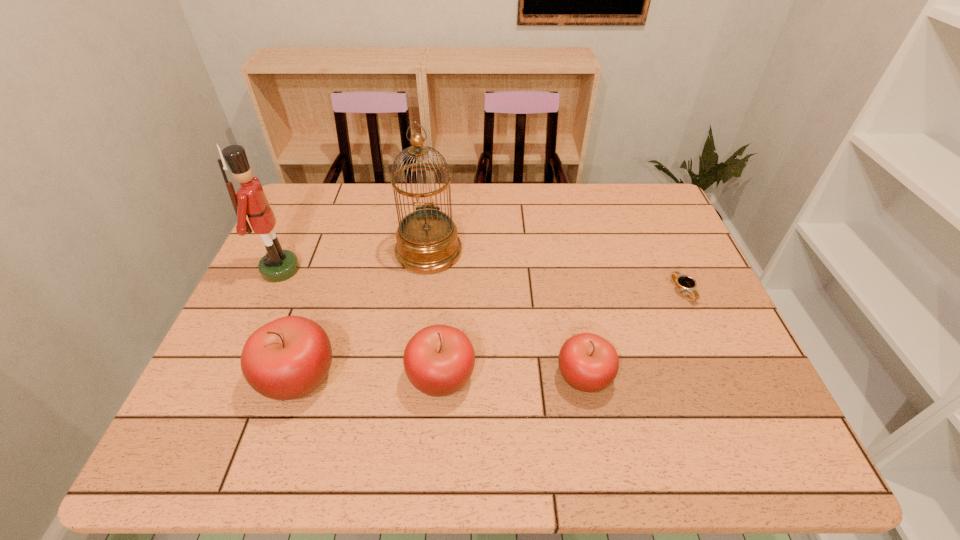
At what (x,y) coordinates should I click in order to perform the action: click on vacant space at the near edge of the desktop. Please return your answer as a coordinate pair (x, y). Looking at the image, I should click on point(384,411).

This screenshot has width=960, height=540. In order to click on vacant space at the left edge in this screenshot , I will do `click(296, 298)`.

Locate an element on the screen. This screenshot has width=960, height=540. free space at the right edge of the desktop is located at coordinates (682, 249).

Where is `free space at the far left corner of the desktop`? The width and height of the screenshot is (960, 540). free space at the far left corner of the desktop is located at coordinates (294, 221).

The image size is (960, 540). What are the coordinates of `vacant area at the near left corner of the desktop` in the screenshot? It's located at (195, 406).

This screenshot has height=540, width=960. Find the location of `vacant space at the far right corner of the desktop`. vacant space at the far right corner of the desktop is located at coordinates (638, 223).

At what (x,y) coordinates should I click in order to perform the action: click on free space between the shortest object and the shortest apple. Please return your answer as a coordinate pair (x, y). This screenshot has height=540, width=960. Looking at the image, I should click on (634, 334).

Image resolution: width=960 pixels, height=540 pixels. I want to click on free space between the birdcage and the rightmost object, so click(x=556, y=272).

You are a GUI agent. You are given a task and a screenshot of the screen. Output one action in this format:
    pyautogui.click(x=<x>, y=<y>)
    Task: Click on the free space between the birdcage and the nutcracker
    
    Given the screenshot: What is the action you would take?
    pyautogui.click(x=355, y=260)

Image resolution: width=960 pixels, height=540 pixels. Find the location of `vacant space that's between the birdcage and the second object from right to left`. vacant space that's between the birdcage and the second object from right to left is located at coordinates (506, 314).